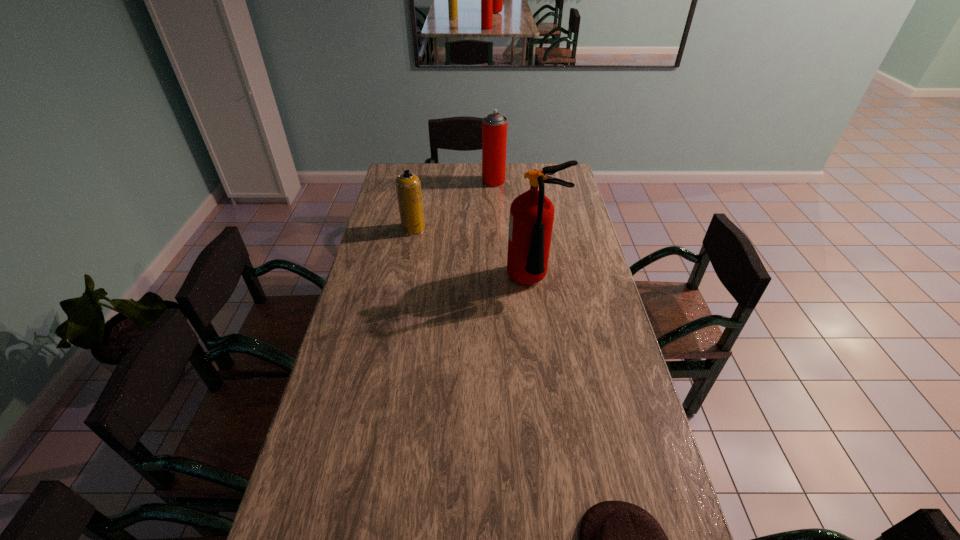
At what (x,y) coordinates should I click in order to perform the action: click on the second nearest object. Please return your answer as a coordinate pair (x, y). Image resolution: width=960 pixels, height=540 pixels. Looking at the image, I should click on (531, 218).

Find the location of a particular element. This screenshot has width=960, height=540. fire extinguisher is located at coordinates (531, 218).

Where is `the farther aerosol can`? This screenshot has height=540, width=960. the farther aerosol can is located at coordinates (494, 126).

Where is `the taller aerosol can`? Image resolution: width=960 pixels, height=540 pixels. the taller aerosol can is located at coordinates (494, 126).

What are the coordinates of `the nearer aerosol can` in the screenshot? It's located at point(408,186).

Locate an element on the screen. The image size is (960, 540). the shorter aerosol can is located at coordinates (408, 186).

Where is `vacant space located 0.050m at the nozzle of the tallest object`? The image size is (960, 540). vacant space located 0.050m at the nozzle of the tallest object is located at coordinates (539, 313).

Find the location of a particular element. Image resolution: width=960 pixels, height=540 pixels. vacant space located on the front of the taller aerosol can is located at coordinates (496, 234).

Where is `free space located on the left of the shorter aerosol can`? The height and width of the screenshot is (540, 960). free space located on the left of the shorter aerosol can is located at coordinates (385, 229).

In order to click on object located at the far edge in this screenshot , I will do `click(494, 126)`.